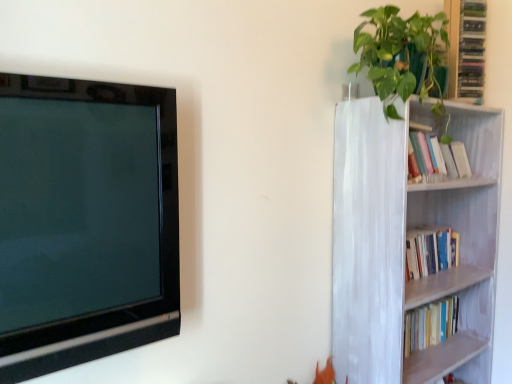
Identify the location of free region under black glossy television at left (from a real-world perspective). (92, 332).